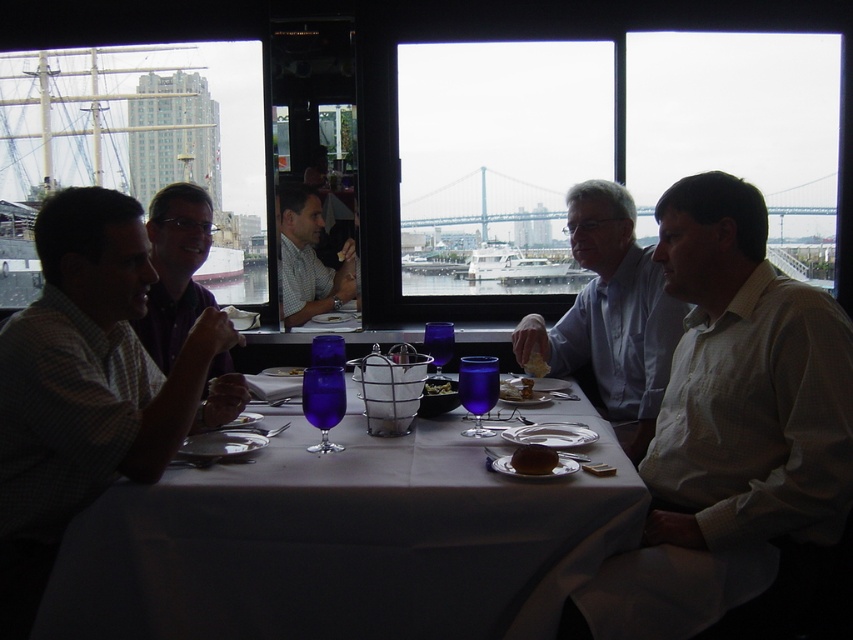
Question: Which point is closer to the camera?

Choices:
 (A) (540, 449)
 (B) (671, 227)
 (C) (106, 428)
 (D) (483, 524)

Answer: (D)

Question: Which is farther from the matte white shirt at center?

Choices:
 (A) matte purple shirt at center
 (B) checkered shirt at left

Answer: (B)

Question: Does white shirt at right appear on the left side of brown matte bread at center?

Choices:
 (A) yes
 (B) no

Answer: (B)

Question: In this image, where is white shirt at right located relative to golden crumbly pastry at center?

Choices:
 (A) above
 (B) below

Answer: (A)

Question: Which object is the farthest from the spongy yellow bread at center?

Choices:
 (A) brown matte bread at center
 (B) white checkered shirt at right
 (C) white cloth at center
 (D) matte purple shirt at center

Answer: (D)

Question: Is matte white shirt at center smaller than smooth brown bread at center?

Choices:
 (A) no
 (B) yes

Answer: (A)